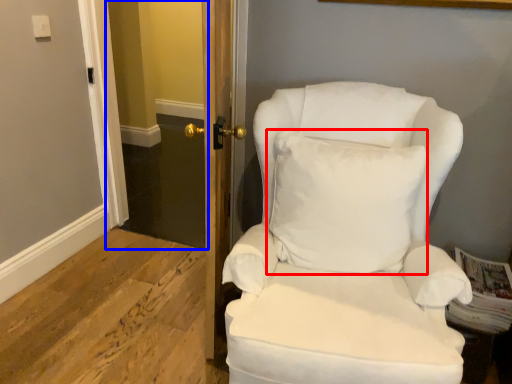
Question: Among these objects, which one is nearest to the camera, pillow (highlighted by a red box) or glass door (highlighted by a blue box)?

Choices:
 (A) pillow
 (B) glass door

Answer: (A)